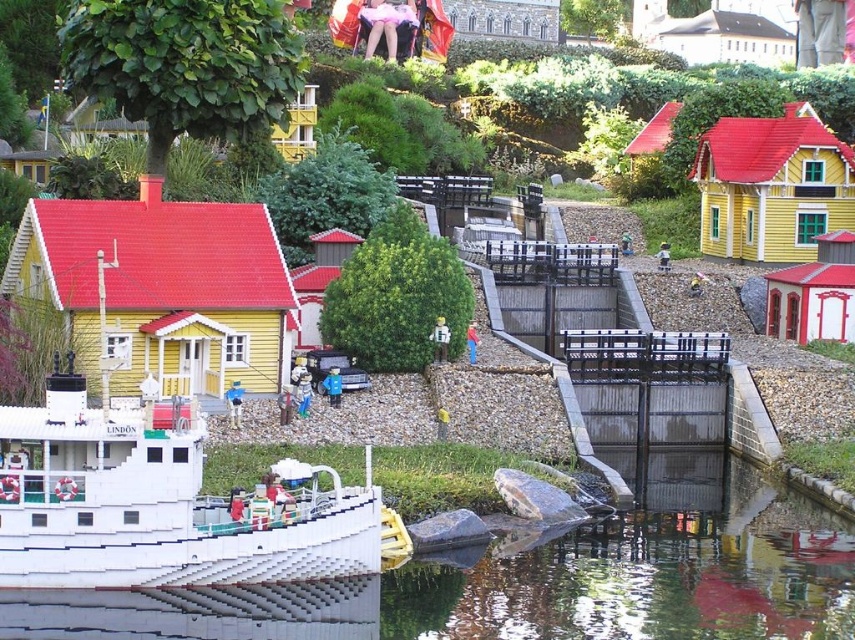
Question: Is clear glass water at lower center thinner than blue plastic figure at center?

Choices:
 (A) no
 (B) yes

Answer: (A)

Question: From the image, what is the correct spatial relationship of yellow plastic figure at center in relation to blue plastic figure at center?

Choices:
 (A) right
 (B) left

Answer: (A)

Question: Estimate the real-world distances between objects in this image. Which object is farther from the clear glass water at lower center?

Choices:
 (A) yellow plastic figure at center
 (B) white plastic boat at center
 (C) smooth plastic toy at center
 (D) blue plastic figure at center

Answer: (C)

Question: In this image, where is white plastic boat at center located relative to smooth plastic figure at center?

Choices:
 (A) below
 (B) above

Answer: (A)

Question: Which point is farther from the camera taking this photo?

Choices:
 (A) (665, 600)
 (B) (340, 378)
 (C) (227, 392)
 (D) (1, 424)

Answer: (B)

Question: Which of these objects is positioned closest to the yellow plastic figure at center?

Choices:
 (A) blue plastic figure at center
 (B) smooth plastic toy at center

Answer: (A)